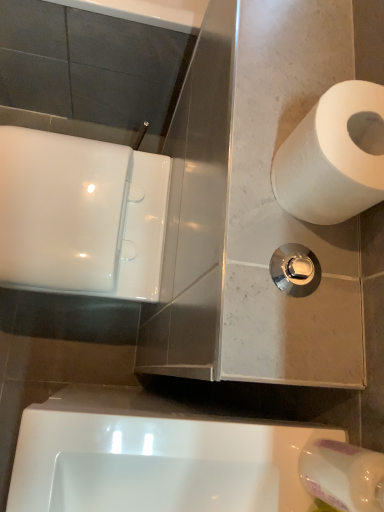
Question: Considering the relative positions of white matte toilet paper at upper right, the first toilet paper positioned from the bottom, and white glossy urinal at lower center in the image provided, is white matte toilet paper at upper right, the first toilet paper positioned from the bottom, behind white glossy urinal at lower center?

Choices:
 (A) yes
 (B) no

Answer: (B)

Question: Is white matte toilet paper at upper right, the first toilet paper positioned from the bottom, facing towards white glossy urinal at lower center?

Choices:
 (A) no
 (B) yes

Answer: (A)

Question: Is white matte toilet paper at upper right, the second toilet paper in the top-to-bottom sequence, shorter than white glossy urinal at lower center?

Choices:
 (A) yes
 (B) no

Answer: (A)

Question: Is white matte toilet paper at upper right, the second toilet paper in the top-to-bottom sequence, far away from white glossy urinal at lower center?

Choices:
 (A) no
 (B) yes

Answer: (A)

Question: Is white glossy urinal at lower center surrounded by white matte toilet paper at upper right, the second toilet paper in the top-to-bottom sequence?

Choices:
 (A) yes
 (B) no

Answer: (B)

Question: Considering the positions of white paper at right, placed as the second toilet paper when sorted from bottom to top, and white glossy urinal at lower center in the image, is white paper at right, placed as the second toilet paper when sorted from bottom to top, wider or thinner than white glossy urinal at lower center?

Choices:
 (A) wide
 (B) thin

Answer: (B)

Question: Is white paper at right, placed as the second toilet paper when sorted from bottom to top, bigger or smaller than white glossy urinal at lower center?

Choices:
 (A) small
 (B) big

Answer: (A)

Question: From the image's perspective, is white paper at right, the 1th toilet paper when ordered from top to bottom, positioned above or below white glossy urinal at lower center?

Choices:
 (A) above
 (B) below

Answer: (A)

Question: Based on their positions, is white paper at right, the 1th toilet paper when ordered from top to bottom, located to the left or right of white glossy urinal at lower center?

Choices:
 (A) right
 (B) left

Answer: (A)

Question: Considering the relative positions of polished chrome flush handle at center-right and white matte toilet paper at upper right, the first toilet paper positioned from the bottom, in the image provided, is polished chrome flush handle at center-right to the left or to the right of white matte toilet paper at upper right, the first toilet paper positioned from the bottom,?

Choices:
 (A) left
 (B) right

Answer: (A)

Question: Considering the positions of polished chrome flush handle at center-right and white matte toilet paper at upper right, the first toilet paper positioned from the bottom, in the image, is polished chrome flush handle at center-right bigger or smaller than white matte toilet paper at upper right, the first toilet paper positioned from the bottom,?

Choices:
 (A) small
 (B) big

Answer: (A)

Question: Does point (301, 271) appear closer or farther from the camera than point (322, 458)?

Choices:
 (A) farther
 (B) closer

Answer: (A)

Question: Considering the positions of polished chrome flush handle at center-right and white matte toilet paper at upper right, the second toilet paper in the top-to-bottom sequence, in the image, is polished chrome flush handle at center-right taller or shorter than white matte toilet paper at upper right, the second toilet paper in the top-to-bottom sequence,?

Choices:
 (A) tall
 (B) short

Answer: (B)

Question: Does point (375, 92) appear closer or farther from the camera than point (357, 470)?

Choices:
 (A) closer
 (B) farther

Answer: (B)

Question: Is white paper at right, the 1th toilet paper when ordered from top to bottom, bigger or smaller than white matte toilet paper at upper right, the second toilet paper in the top-to-bottom sequence?

Choices:
 (A) big
 (B) small

Answer: (A)